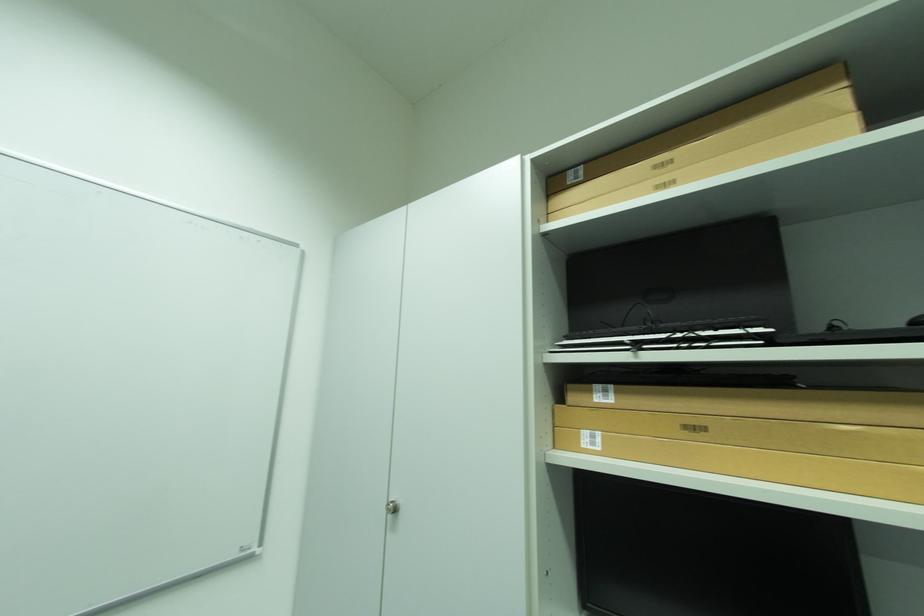
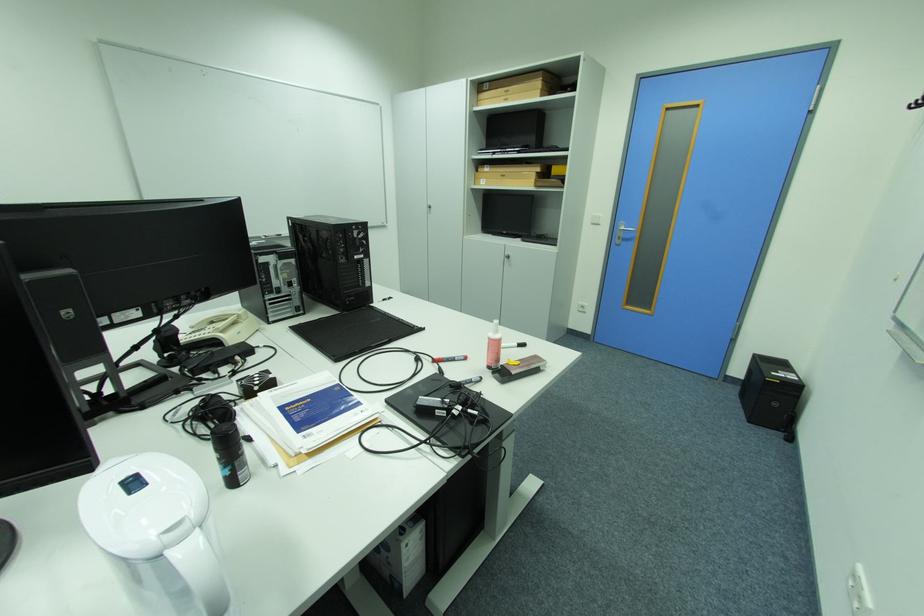
In the second image, find the point that corresponds to [593,434] in the first image.

(490, 180)